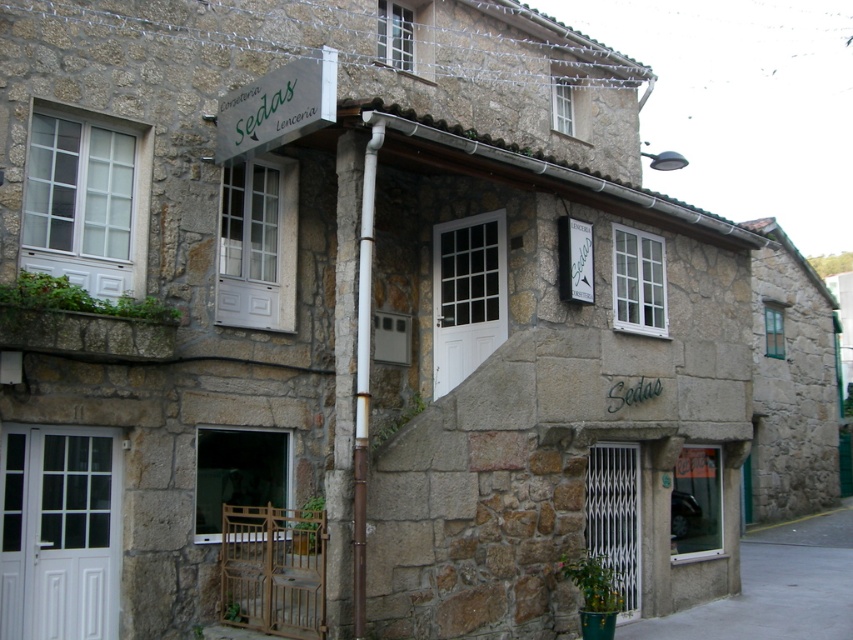
Describe the element at coordinates (351, 376) in the screenshot. I see `brown stone pillar at center` at that location.

Between brown stone pillar at center and white glossy pipe at center, which one appears on the right side from the viewer's perspective?

From the viewer's perspective, white glossy pipe at center appears more on the right side.

The width and height of the screenshot is (853, 640). Identify the location of brown stone pillar at center. (351, 376).